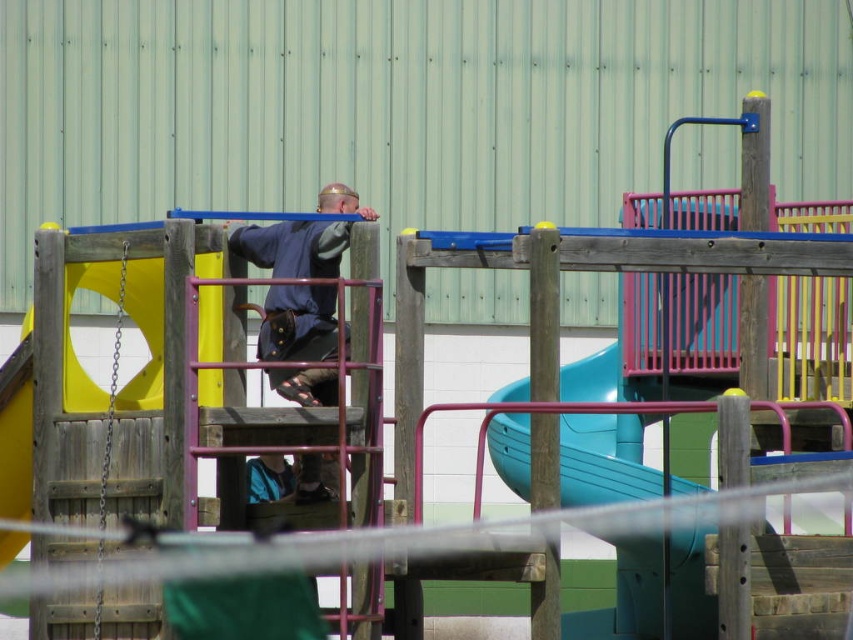
Based on the photo, you are standing at the point marked by the coordinates point (292,248). You want to walk to the blue slide on the right. Which direction should you go?

Since the point (292,248) represents the dark blue fabric shirt at center, you should walk towards the right to reach the blue slide on the right.